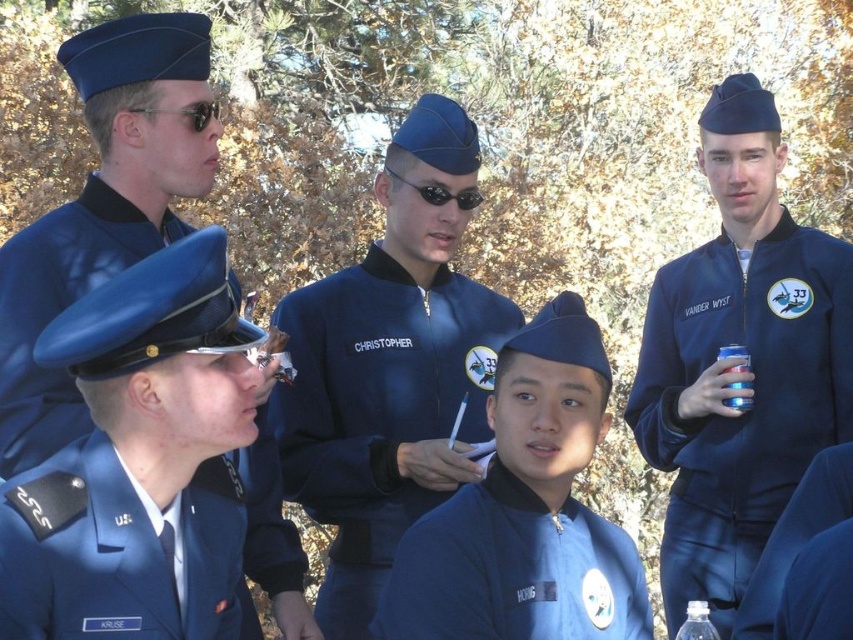
Question: Which of the following is the closest to the observer?

Choices:
 (A) (753, 632)
 (B) (45, 472)
 (C) (10, 401)

Answer: (B)

Question: Can you confirm if navy blue fabric jacket at center is wider than blue fabric uniform at lower right?

Choices:
 (A) yes
 (B) no

Answer: (A)

Question: Which of the following is the closest to the observer?

Choices:
 (A) matte blue uniform at upper left
 (B) blue fabric uniform at lower right

Answer: (A)

Question: Can you confirm if blue matte jacket at upper right is positioned to the left of blue fabric uniform at lower right?

Choices:
 (A) yes
 (B) no

Answer: (B)

Question: Does blue matte jacket at upper right have a larger size compared to navy blue fabric jacket at center?

Choices:
 (A) no
 (B) yes

Answer: (B)

Question: Among these objects, which one is nearest to the camera?

Choices:
 (A) navy blue fabric jacket at center
 (B) matte blue uniform at center
 (C) blue fabric uniform at lower right
 (D) blue fabric uniform at lower left

Answer: (D)